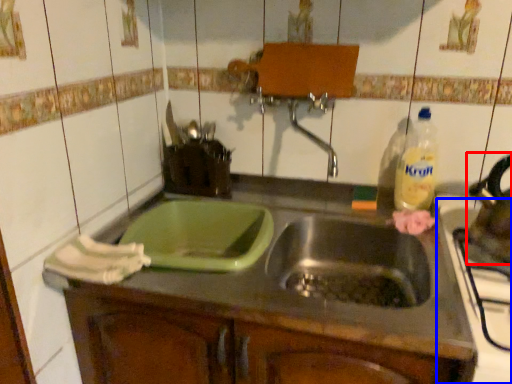
Question: Which of the following is the farthest to the observer, tea pot (highlighted by a red box) or appliance (highlighted by a blue box)?

Choices:
 (A) tea pot
 (B) appliance

Answer: (A)